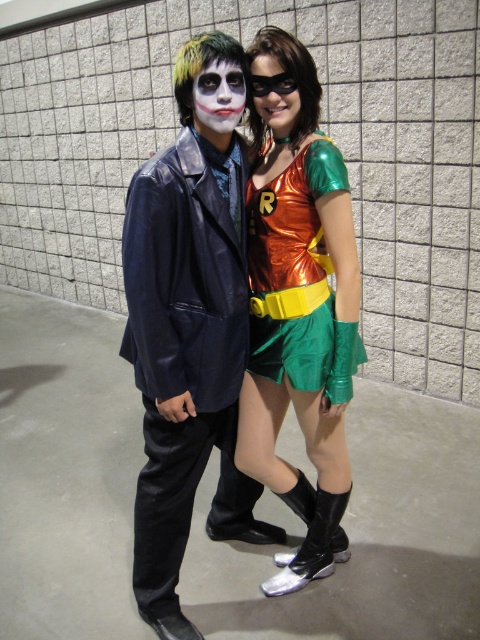
You are a photographer at a convention and need to position a spotlight exactly at the center of the matte white face at center. According to the coordinates provided, where should you aim the spotlight?

The spotlight should be aimed at point 0.153 on the x axis and 0.454 on the y axis, corresponding to the coordinates of the matte white face at center.

You are a photographer setting up for a group photo. You need to position the shiny black suit at center and the metallic green shorts at center so that both fit within the camera frame. Given that the camera frame can only accommodate objects up to the width of the wider of the two, which object determines the minimum required frame width?

The shiny black suit at center has a larger width than the metallic green shorts at center, so the minimum required frame width must be at least the width of the shiny black suit at center to accommodate both objects.